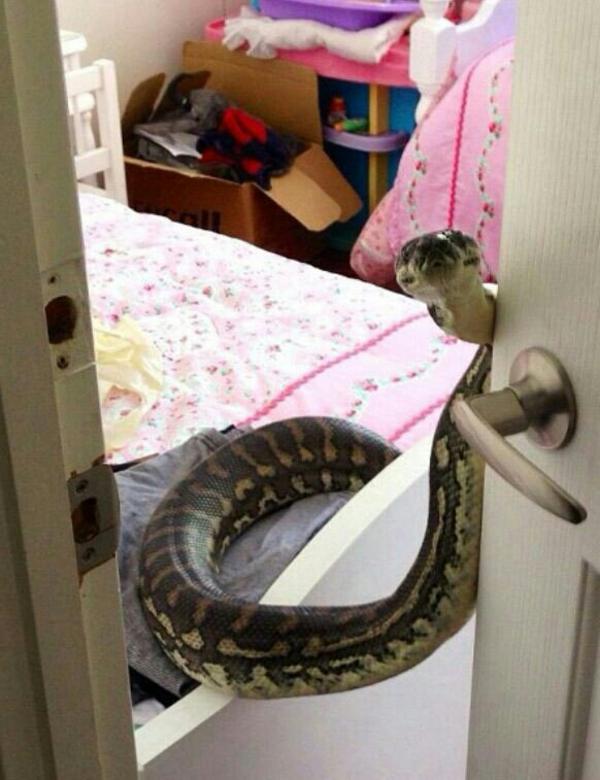
Where is `dollhouse`? dollhouse is located at coordinates tap(380, 118).